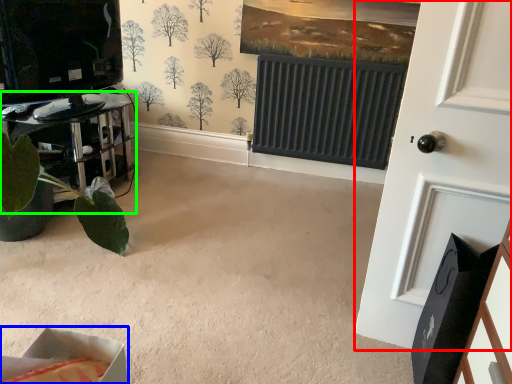
Question: Which object is positioned farthest from door (highlighted by a red box)? Select from cardboard box (highlighted by a blue box) and furniture (highlighted by a green box).

Choices:
 (A) cardboard box
 (B) furniture

Answer: (B)